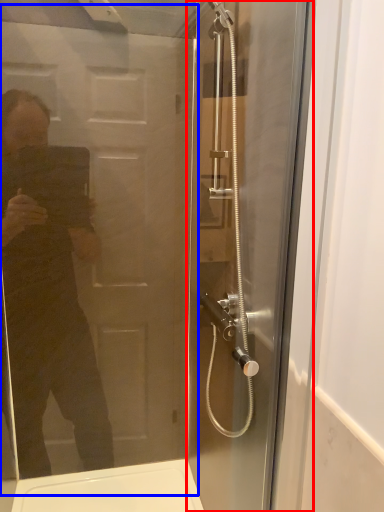
Question: Which of the following is the farthest to the observer, screen door (highlighted by a red box) or screen door (highlighted by a blue box)?

Choices:
 (A) screen door
 (B) screen door

Answer: (A)